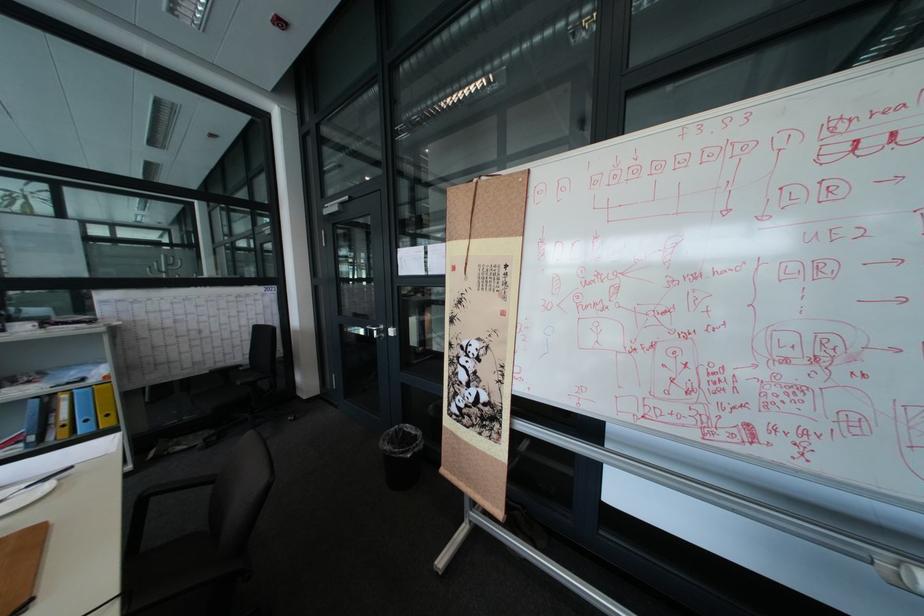
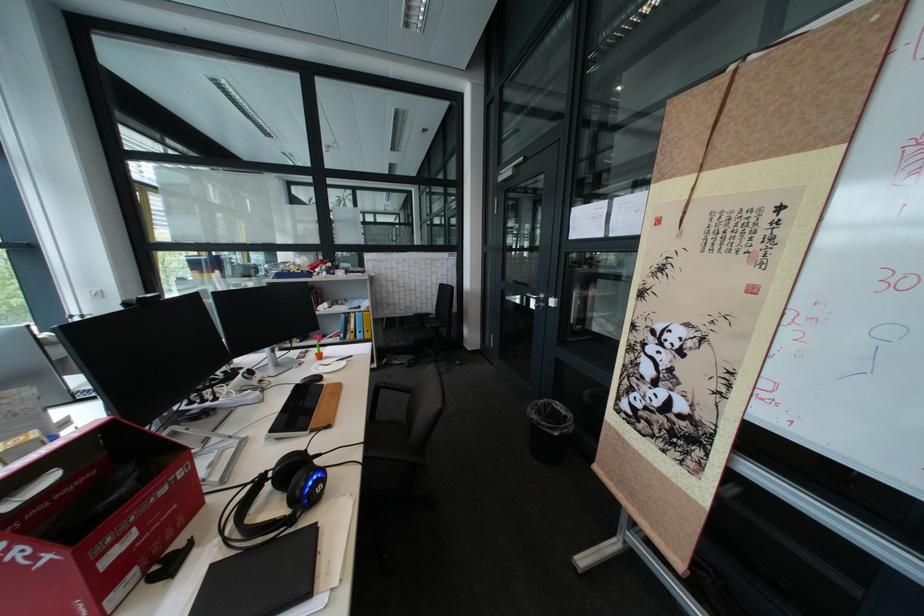
Locate, in the second image, the point that corresponds to the point at 407,429 in the first image.

(555, 400)